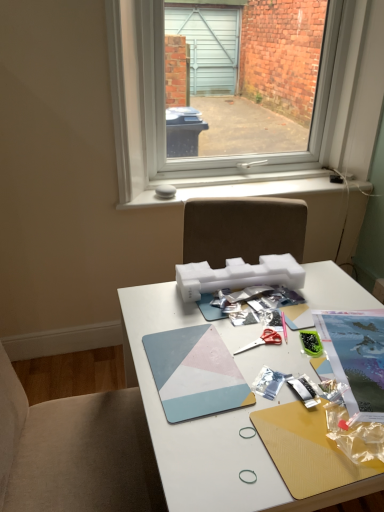
At what (x,y) coordinates should I click in order to perform the action: click on free point below printed paper magazine at center right, the second magazine when ordered from left to right (from a real-world perspective). Please return your answer as a coordinate pair (x, y). The height and width of the screenshot is (512, 384). Looking at the image, I should click on (358, 350).